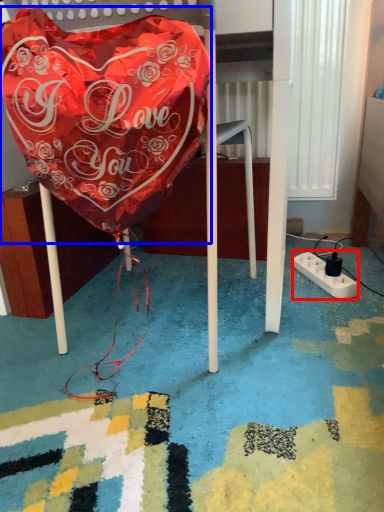
Question: Which point is closer to the camera, extension cord (highlighted by a red box) or blanket (highlighted by a blue box)?

Choices:
 (A) extension cord
 (B) blanket

Answer: (B)